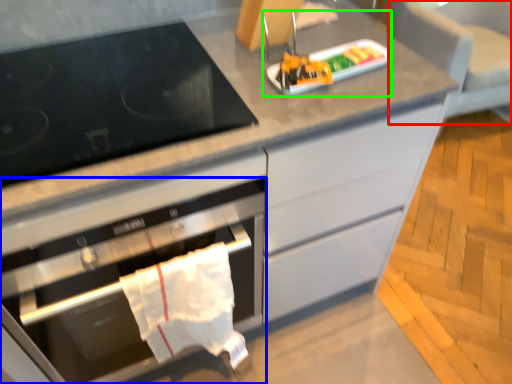
Question: Considering the real-world distances, which object is farthest from armchair (highlighted by a red box)? oven (highlighted by a blue box) or appliance (highlighted by a green box)?

Choices:
 (A) oven
 (B) appliance

Answer: (A)